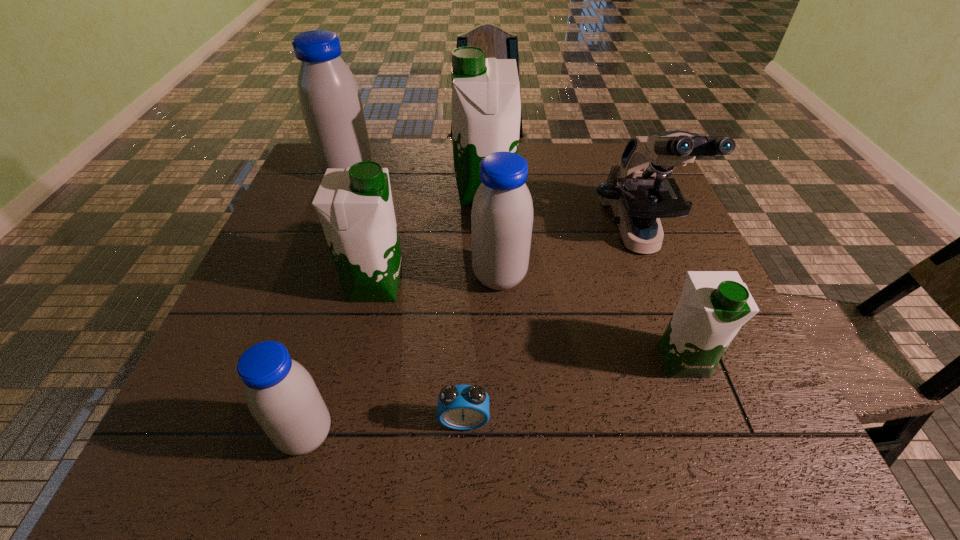
Identify the location of free space that satisfies the following two spatial constraints: 1. on the front-facing side of the biggest green soya milk; 2. on the face of the shortest object. (489, 420).

The width and height of the screenshot is (960, 540). I want to click on free space that satisfies the following two spatial constraints: 1. on the front-facing side of the second green soya milk from left to right; 2. on the back side of the second smallest blue soya milk, so click(x=487, y=277).